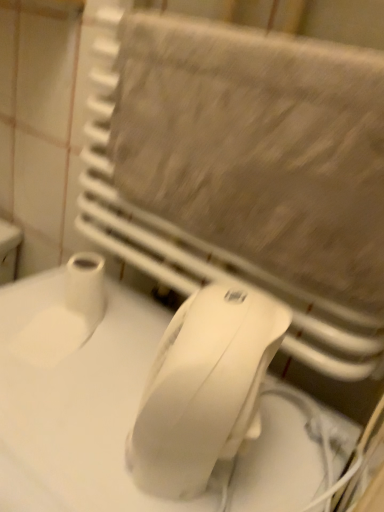
Question: From the image's perspective, does white matte countertop at lower left appear lower than white plastic mouse at center?

Choices:
 (A) no
 (B) yes

Answer: (B)

Question: Can you confirm if white matte countertop at lower left is bigger than white plastic mouse at center?

Choices:
 (A) yes
 (B) no

Answer: (A)

Question: Is white matte countertop at lower left located outside white plastic mouse at center?

Choices:
 (A) yes
 (B) no

Answer: (A)

Question: Is white matte countertop at lower left far away from white plastic mouse at center?

Choices:
 (A) yes
 (B) no

Answer: (B)

Question: Could you tell me if white matte countertop at lower left is facing white plastic mouse at center?

Choices:
 (A) no
 (B) yes

Answer: (A)

Question: Considering the positions of point (89, 281) and point (339, 139), is point (89, 281) closer or farther from the camera than point (339, 139)?

Choices:
 (A) farther
 (B) closer

Answer: (A)

Question: Considering the positions of white matte toilet paper at lower left and beige textured towel at upper center in the image, is white matte toilet paper at lower left taller or shorter than beige textured towel at upper center?

Choices:
 (A) short
 (B) tall

Answer: (A)

Question: Is white matte toilet paper at lower left situated inside beige textured towel at upper center or outside?

Choices:
 (A) outside
 (B) inside

Answer: (A)

Question: From the image's perspective, is white matte toilet paper at lower left above or below beige textured towel at upper center?

Choices:
 (A) below
 (B) above

Answer: (A)

Question: Would you say white matte toilet paper at lower left is to the left or to the right of white plastic mouse at center in the picture?

Choices:
 (A) right
 (B) left

Answer: (B)

Question: Choose the correct answer: Is white matte toilet paper at lower left inside white plastic mouse at center or outside it?

Choices:
 (A) inside
 (B) outside

Answer: (B)

Question: From the image's perspective, is white matte toilet paper at lower left positioned above or below white plastic mouse at center?

Choices:
 (A) above
 (B) below

Answer: (A)

Question: In terms of height, does white matte toilet paper at lower left look taller or shorter compared to white plastic mouse at center?

Choices:
 (A) short
 (B) tall

Answer: (A)

Question: From their relative heights in the image, would you say beige textured towel at upper center is taller or shorter than white plastic mouse at center?

Choices:
 (A) short
 (B) tall

Answer: (B)

Question: Considering their positions, is beige textured towel at upper center located in front of or behind white plastic mouse at center?

Choices:
 (A) front
 (B) behind

Answer: (B)